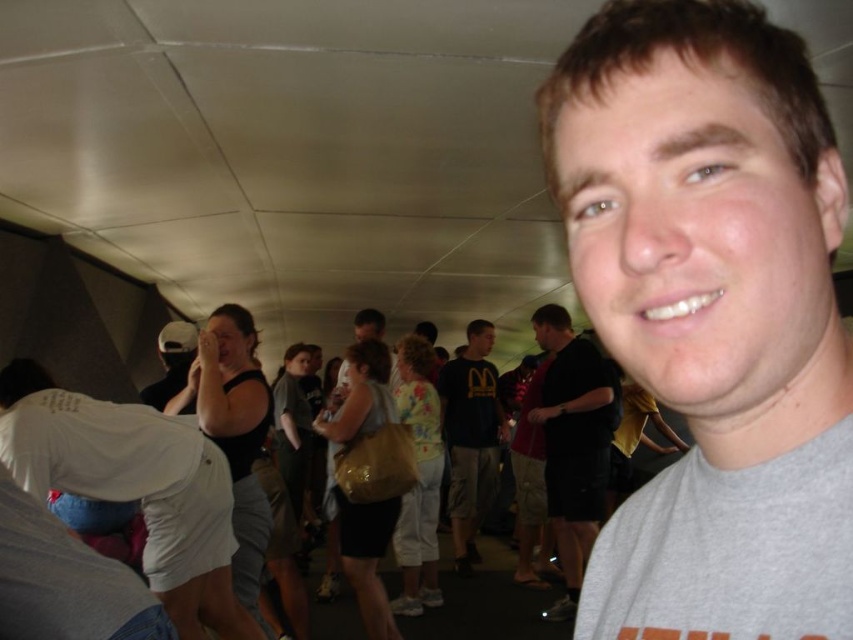
Question: Which object is closer to the camera taking this photo?

Choices:
 (A) white matte shirt at lower left
 (B) dark gray t-shirt at center
 (C) dark blue t-shirt at center
 (D) gray matte t-shirt at center

Answer: (D)

Question: Which of the following is the closest to the observer?

Choices:
 (A) (567, 588)
 (B) (689, 413)
 (C) (219, 481)
 (D) (469, 481)

Answer: (B)

Question: Can you confirm if gray matte t-shirt at center is bigger than dark blue t-shirt at center?

Choices:
 (A) yes
 (B) no

Answer: (B)

Question: Which of these objects is positioned farthest from the dark blue t-shirt at center?

Choices:
 (A) gray matte t-shirt at center
 (B) dark gray t-shirt at center
 (C) white matte shirt at lower left

Answer: (A)

Question: Can you confirm if gray matte t-shirt at center is smaller than dark blue t-shirt at center?

Choices:
 (A) yes
 (B) no

Answer: (A)

Question: Is gray matte t-shirt at center wider than white matte shirt at lower left?

Choices:
 (A) yes
 (B) no

Answer: (B)